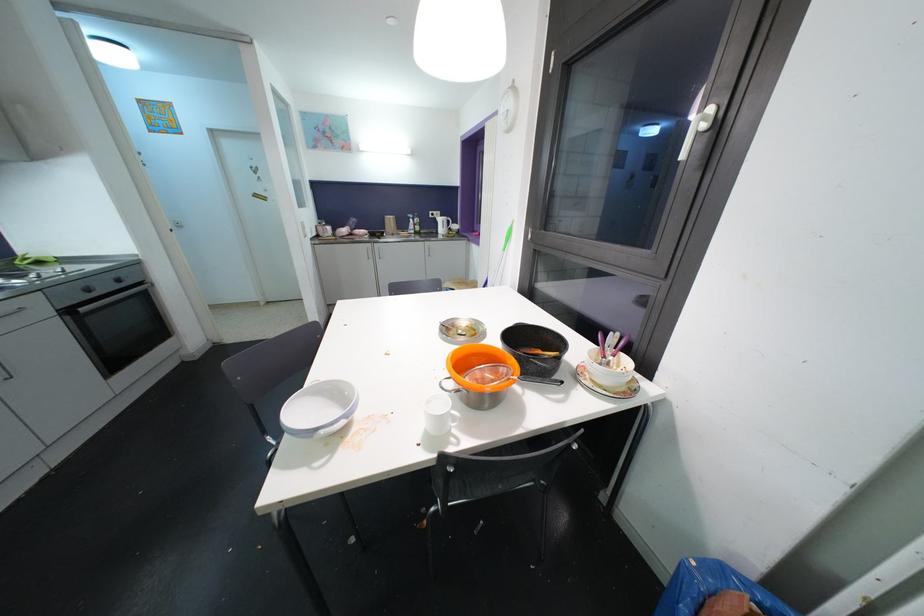
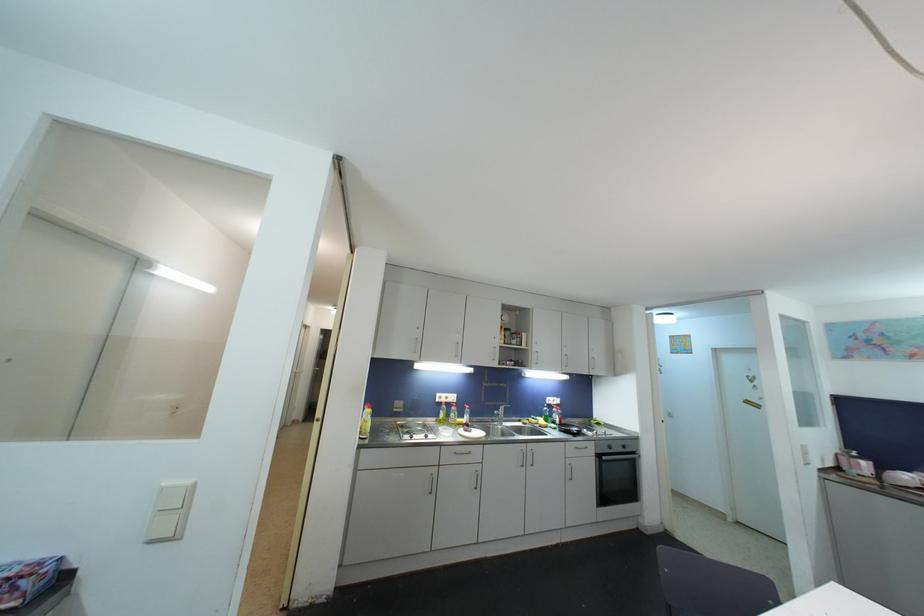
Where in the second image is the point corresponding to point 117,365 from the first image?

(608, 501)